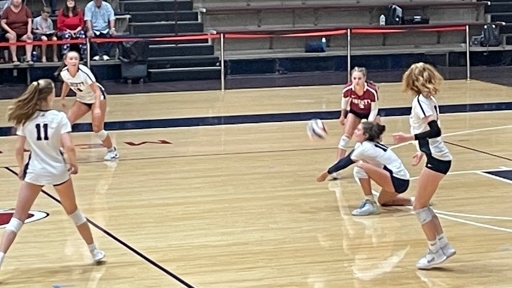
Locate an element on the screen. Image resolution: width=512 pixels, height=288 pixels. gymnasium floor is located at coordinates (237, 222).